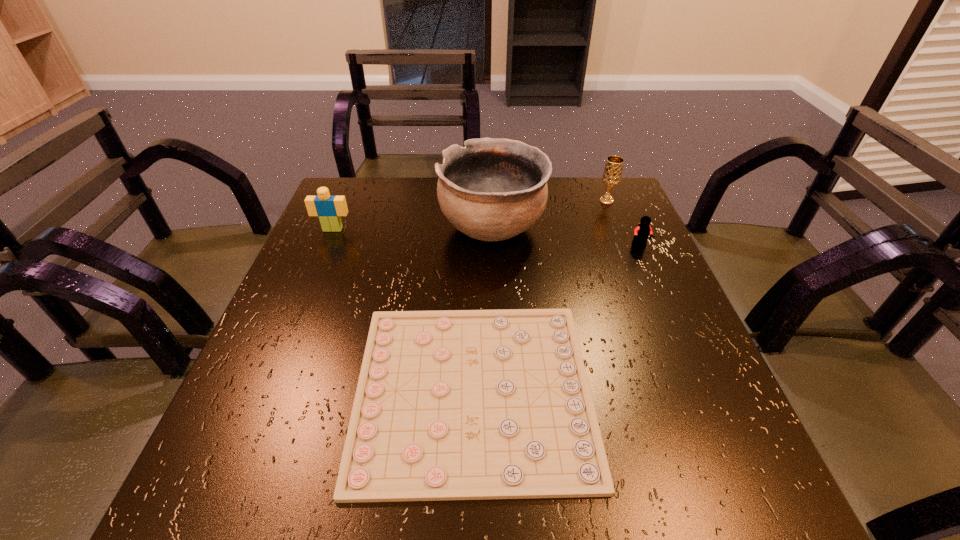
Image resolution: width=960 pixels, height=540 pixels. Find the location of `the tallest object`. the tallest object is located at coordinates (492, 189).

Locate an element on the screen. chalice is located at coordinates (612, 173).

Find the location of a particular element. The height and width of the screenshot is (540, 960). the left Lego is located at coordinates (329, 208).

Image resolution: width=960 pixels, height=540 pixels. I want to click on the farther Lego, so click(x=329, y=208).

Find the location of `the nearer Lego`. the nearer Lego is located at coordinates (641, 233).

This screenshot has width=960, height=540. In order to click on the right Lego in this screenshot , I will do `click(641, 233)`.

Find the location of a particular element. The height and width of the screenshot is (540, 960). gameboard is located at coordinates tap(457, 404).

Locate an element on the screen. The image size is (960, 540). the nearest object is located at coordinates (457, 404).

The image size is (960, 540). I want to click on blank space located on the right of the tallest object, so click(635, 227).

The height and width of the screenshot is (540, 960). What are the coordinates of `free spot located on the front of the chalice` in the screenshot? It's located at (614, 220).